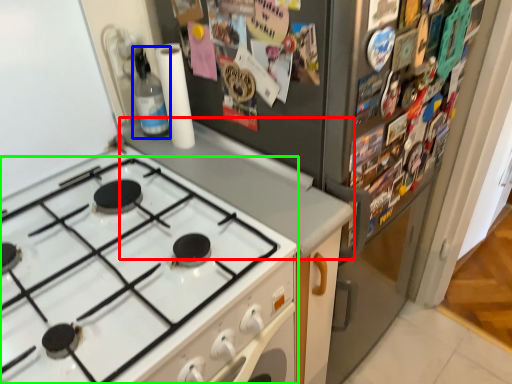
Question: Which is nearer to the counter top (highlighted by a red box)? bottle (highlighted by a blue box) or gas stove (highlighted by a green box).

Choices:
 (A) bottle
 (B) gas stove

Answer: (B)